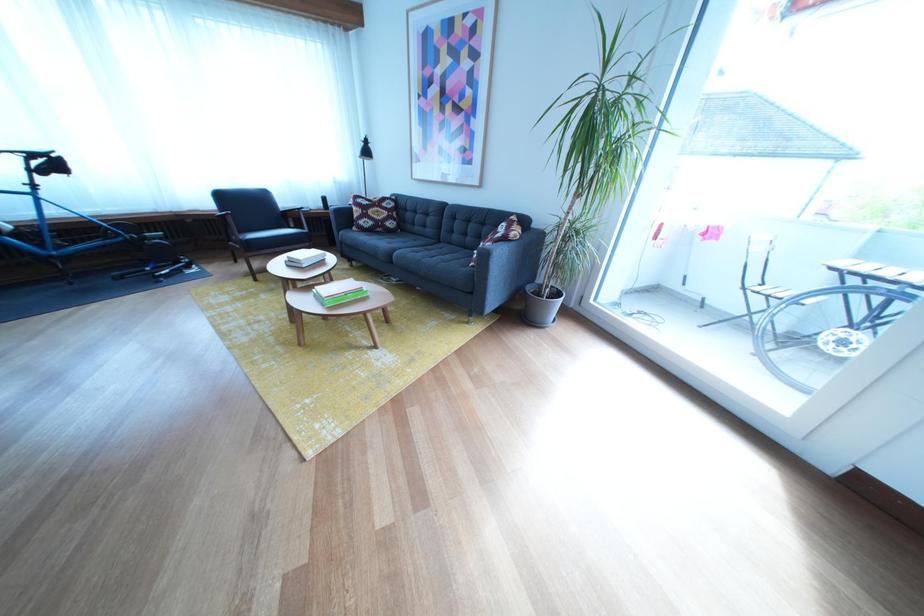
The width and height of the screenshot is (924, 616). I want to click on grey sofa armrest, so click(x=515, y=248).